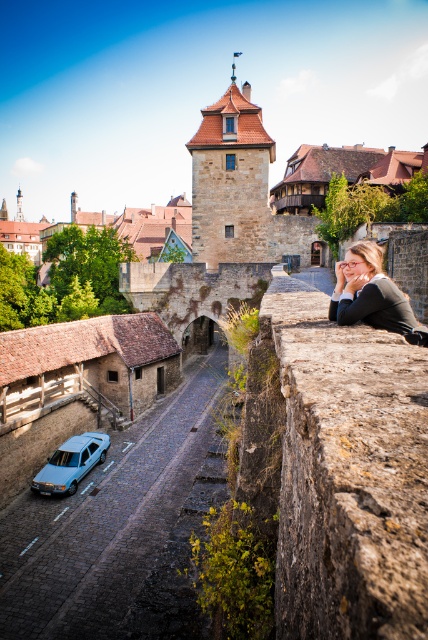
You are standing on a cobblestone street in a historic European town and notice a rusty stone ledge at right and a matte black sweater at center. Which object is closer to you?

The rusty stone ledge at right is closer to you because it is in front of the matte black sweater at center.

You are standing at the top of the stone tower with a red roof in the historic European town. Looking down, you notice a matte black sweater at center. Where exactly is the matte black sweater located in terms of coordinates?

The matte black sweater at center is located at coordinates point (x=371, y=294).